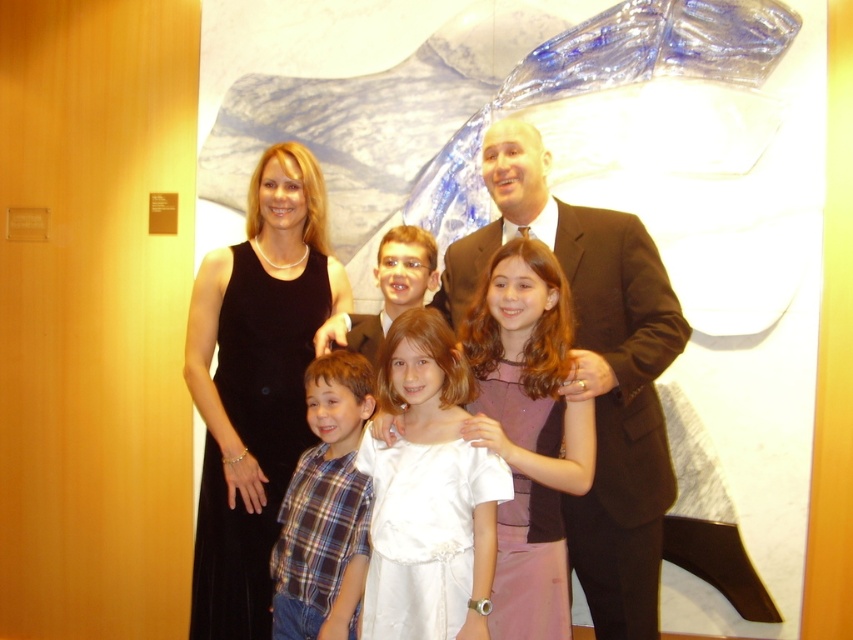
You are standing in front of the family photo and want to determine the order of the two central figures. Which object is closer to you between the dark brown suit at center and the white satin dress at center?

The dark brown suit at center is closer to you than the white satin dress at center according to the description.

You are a photographer setting up for a family portrait. You notice the dark brown suit at center and the plaid shirt at center in the scene. Which clothing item is positioned higher in the image?

The dark brown suit at center is above the plaid shirt at center, so the dark brown suit at center is positioned higher in the image.